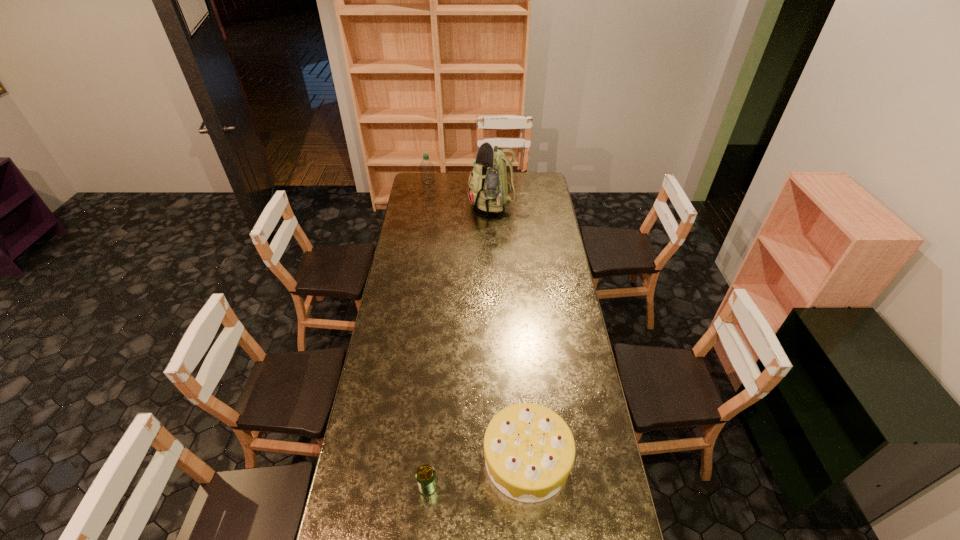
In the image, there is a desktop. Identify the location of free region at the far edge. (518, 173).

Identify the location of vacant space at the left edge of the desktop. (420, 222).

In the image, there is a desktop. Where is `vacant space at the right edge`? vacant space at the right edge is located at coordinates (553, 201).

Image resolution: width=960 pixels, height=540 pixels. Find the location of `vacant area that lies between the birthday cake and the third nearest object`. vacant area that lies between the birthday cake and the third nearest object is located at coordinates (513, 332).

At what (x,y) coordinates should I click in order to perform the action: click on free spot between the shortest object and the farthest object. Please return your answer as a coordinate pair (x, y). The image size is (960, 540). Looking at the image, I should click on (428, 334).

This screenshot has width=960, height=540. In order to click on vacant point located between the leftmost object and the shortest object in this screenshot , I will do `click(428, 334)`.

In order to click on free spot between the birthday cake and the beer can in this screenshot , I will do `click(477, 472)`.

At what (x,y) coordinates should I click in order to perform the action: click on vacant region between the water bottle and the backpack. Please return your answer as a coordinate pair (x, y). Looking at the image, I should click on (464, 193).

At what (x,y) coordinates should I click in order to perform the action: click on free point between the shortest object and the farthest object. Please return your answer as a coordinate pair (x, y). Looking at the image, I should click on (428, 334).

This screenshot has height=540, width=960. Find the location of `free spot between the water bottle and the birthday cake`. free spot between the water bottle and the birthday cake is located at coordinates (477, 320).